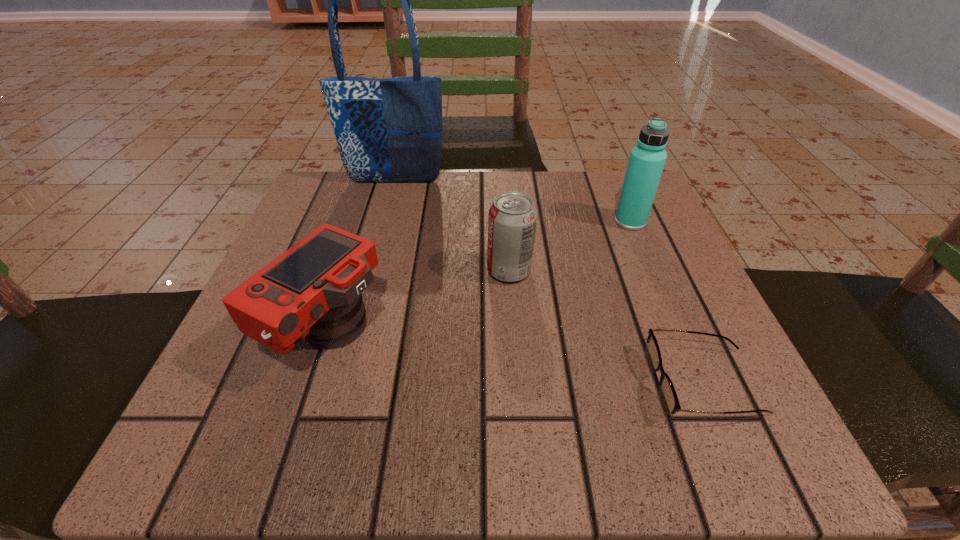
Locate an element on the screen. Image resolution: width=960 pixels, height=540 pixels. thermos bottle that is positioned at the right edge is located at coordinates (647, 159).

At what (x,y) coordinates should I click in order to perform the action: click on spectacles that is at the right edge. Please return your answer as a coordinate pair (x, y). Looking at the image, I should click on (668, 396).

I want to click on object located at the far left corner, so click(388, 130).

Find the location of a particular element. This screenshot has height=540, width=960. object that is at the far right corner is located at coordinates (647, 159).

Identify the location of object at the near right corner. (668, 396).

In the image, there is a desktop. At what (x,y) coordinates should I click in order to perform the action: click on vacant space at the far edge. Please return your answer as a coordinate pair (x, y). This screenshot has height=540, width=960. Looking at the image, I should click on (448, 186).

This screenshot has width=960, height=540. I want to click on vacant space at the near edge, so click(480, 461).

At what (x,y) coordinates should I click in order to perform the action: click on vacant area at the left edge. Please return your answer as a coordinate pair (x, y). Looking at the image, I should click on (301, 388).

At what (x,y) coordinates should I click in order to perform the action: click on vacant space at the right edge of the desktop. Please return your answer as a coordinate pair (x, y). The width and height of the screenshot is (960, 540). Looking at the image, I should click on coord(684,306).

Find the location of a particular element. free space at the far left corner of the desktop is located at coordinates (311, 206).